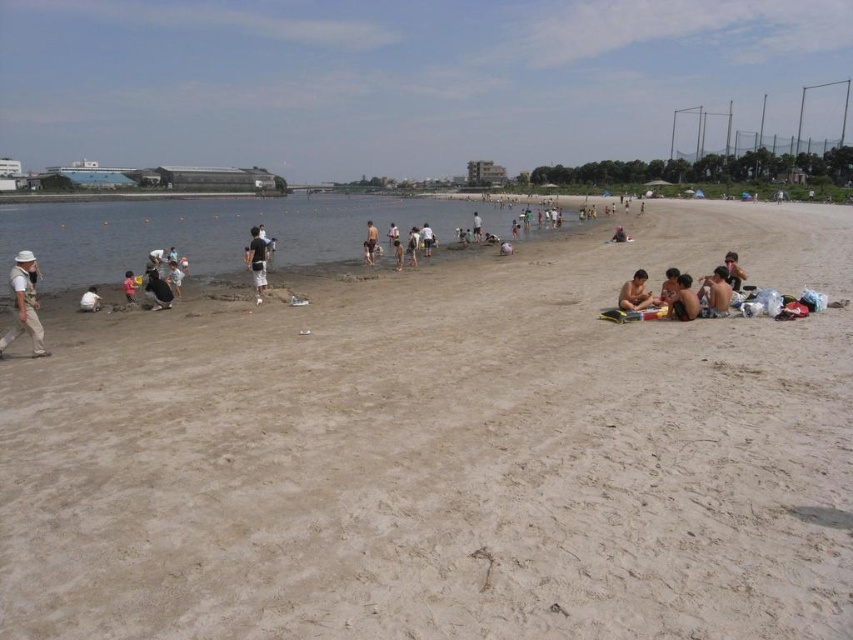
Is dark brown skin at lower right wider than dark blue fabric at lower left?

No, dark brown skin at lower right is not wider than dark blue fabric at lower left.

The width and height of the screenshot is (853, 640). What do you see at coordinates (683, 300) in the screenshot? I see `dark brown skin at lower right` at bounding box center [683, 300].

Does point (677, 298) come in front of point (169, 305)?

Yes, it is.

Where is `dark brown skin at lower right`? dark brown skin at lower right is located at coordinates (683, 300).

From the picture: Is smooth tan skin at lower right below dark brown hair at lower right?

Yes, smooth tan skin at lower right is below dark brown hair at lower right.

Image resolution: width=853 pixels, height=640 pixels. In order to click on smooth tan skin at lower right in this screenshot , I will do `click(635, 292)`.

Is light brown skin at lower right further to the viewer compared to dark blue fabric at lower left?

No, light brown skin at lower right is in front of dark blue fabric at lower left.

Who is positioned more to the right, light brown skin at lower right or dark blue fabric at lower left?

light brown skin at lower right is more to the right.

Is point (729, 296) positioned in front of point (148, 288)?

That is True.

Where is `light brown skin at lower right`? light brown skin at lower right is located at coordinates (714, 292).